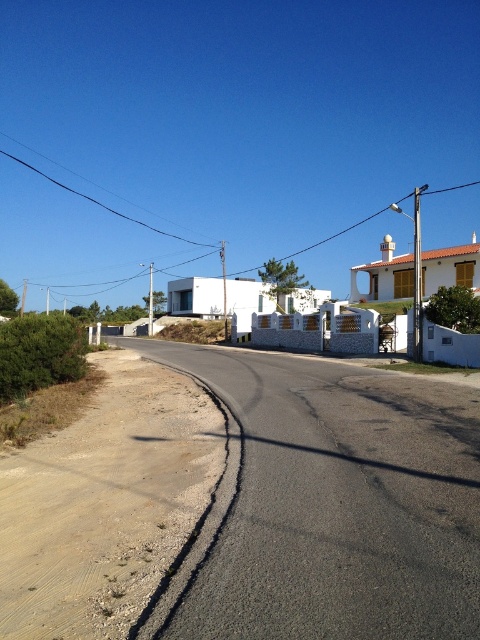
Question: Which object is closer to the camera taking this photo?

Choices:
 (A) asphalt road at lower left
 (B) asphalt road at center

Answer: (A)

Question: Is asphalt road at lower left to the right of asphalt road at center from the viewer's perspective?

Choices:
 (A) yes
 (B) no

Answer: (A)

Question: Which object is closer to the camera taking this photo?

Choices:
 (A) asphalt road at center
 (B) asphalt road at lower left

Answer: (B)

Question: Can you confirm if asphalt road at lower left is smaller than asphalt road at center?

Choices:
 (A) no
 (B) yes

Answer: (A)

Question: Which object is closer to the camera taking this photo?

Choices:
 (A) asphalt road at lower left
 (B) asphalt road at center

Answer: (A)

Question: Is asphalt road at lower left below asphalt road at center?

Choices:
 (A) yes
 (B) no

Answer: (B)